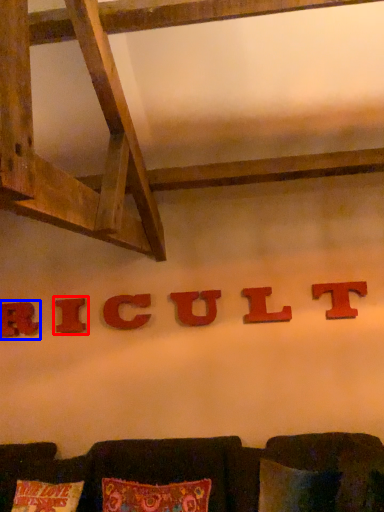
Question: Which point is closer to the camera, alphabet (highlighted by a red box) or alphabet (highlighted by a blue box)?

Choices:
 (A) alphabet
 (B) alphabet

Answer: (A)